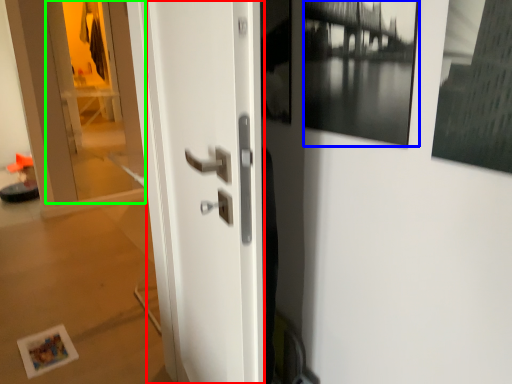
Question: Which object is the farthest from door (highlighted by a red box)? Choose among these: picture frame (highlighted by a blue box) or glass door (highlighted by a green box).

Choices:
 (A) picture frame
 (B) glass door

Answer: (B)